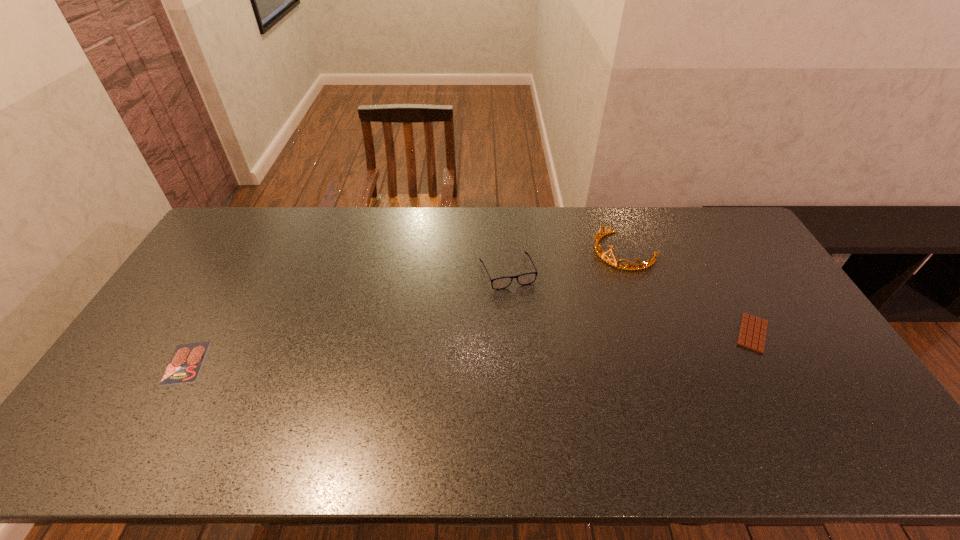
Identify the location of free spot on the desktop that is between the leftmost object and the third tallest object and is positioned on the front-facing side of the tiara. This screenshot has height=540, width=960. (507, 346).

Locate an element on the screen. This screenshot has height=540, width=960. vacant space on the desktop that is between the shortest object and the rightmost object and is positioned on the front-facing side of the spectacles is located at coordinates (539, 345).